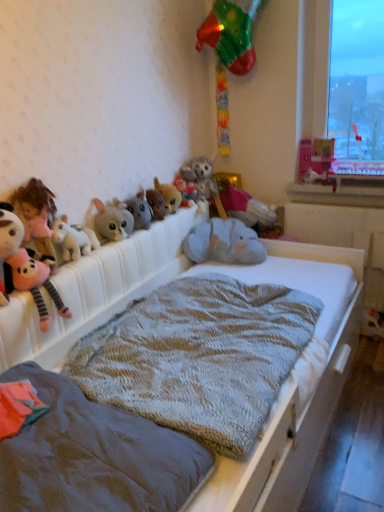
Question: From the image's perspective, is fluffy gray stuffed animal at center positioned above or below white plastic window sill at lower right?

Choices:
 (A) below
 (B) above

Answer: (B)

Question: In terms of size, does fluffy gray stuffed animal at center appear bigger or smaller than white plastic window sill at lower right?

Choices:
 (A) small
 (B) big

Answer: (B)

Question: Which object is the farthest from the fluffy gray elephant at center, which is the 4th toy from right to left?

Choices:
 (A) pink cardboard box at upper right, the first toy viewed from the right
 (B) white plastic window sill at lower right
 (C) textured gray blanket at center, arranged as the 2th blanket when viewed from the front
 (D) fluffy gray stuffed animal at center
 (E) textured gray blanket at center

Answer: (C)

Question: Estimate the real-world distances between objects in this image. Which object is closer to the gray plush elephant at upper center, which ranks as the 9th toy in left-to-right order?

Choices:
 (A) pink plush toy at left, acting as the tenth toy starting from the right
 (B) brown plush toy at upper center, positioned as the sixth toy in left-to-right order
 (C) fluffy gray stuffed animal at center
 (D) white plastic window sill at lower right
 (E) pink cardboard box at upper right, the first toy viewed from the right

Answer: (C)